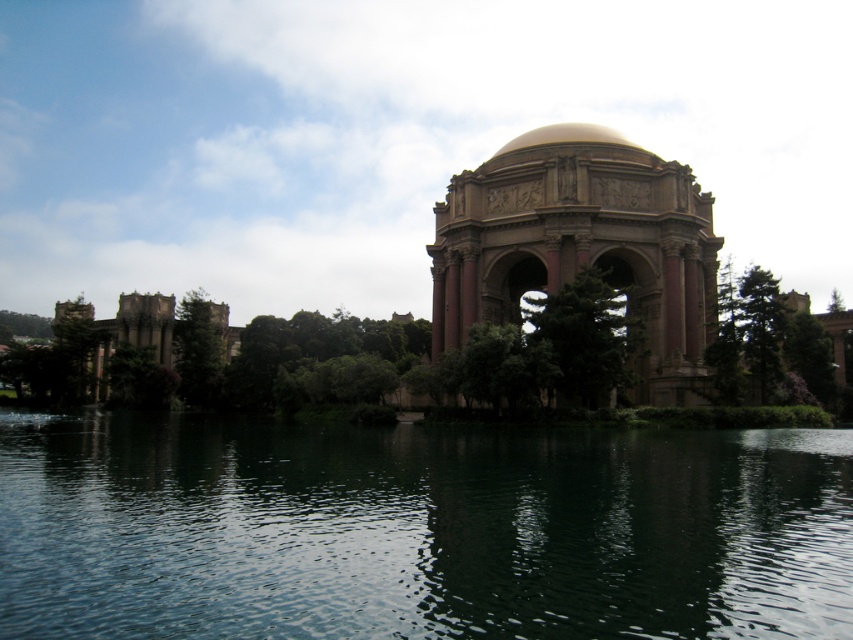
Question: Is marble-like pink archway at center bigger than green leafy tree at center?

Choices:
 (A) yes
 (B) no

Answer: (A)

Question: Which of the following is the farthest from the observer?

Choices:
 (A) green textured tree at right
 (B) green leafy tree at center
 (C) marble-like pink archway at center

Answer: (C)

Question: Which point is farther from the camera taking this photo?

Choices:
 (A) (750, 328)
 (B) (537, 128)
 (C) (757, 573)

Answer: (B)

Question: Is green textured tree at right positioned behind gold polished dome at upper center?

Choices:
 (A) no
 (B) yes

Answer: (A)

Question: Is marble-like pink archway at center positioned behind green leafy tree at center?

Choices:
 (A) no
 (B) yes

Answer: (B)

Question: Estimate the real-world distances between objects in this image. Which object is closer to the green leafy tree at center?

Choices:
 (A) dark green water at center
 (B) green textured tree at right
 (C) green leafy tree at left
 (D) marble-like pink archway at center

Answer: (D)